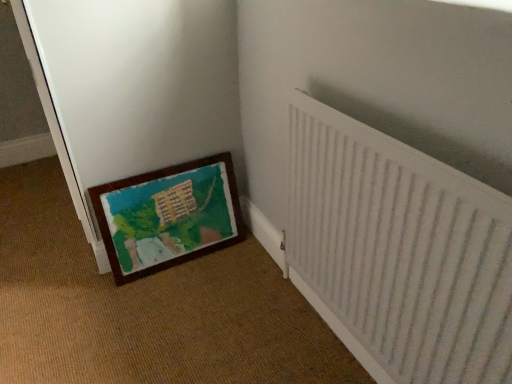
Question: Considering the relative sizes of wooden picture frame at lower left and wooden painted mat at lower left in the image provided, is wooden picture frame at lower left wider than wooden painted mat at lower left?

Choices:
 (A) no
 (B) yes

Answer: (A)

Question: Is wooden picture frame at lower left outside wooden painted mat at lower left?

Choices:
 (A) no
 (B) yes

Answer: (A)

Question: Considering the relative sizes of wooden picture frame at lower left and wooden painted mat at lower left in the image provided, is wooden picture frame at lower left thinner than wooden painted mat at lower left?

Choices:
 (A) no
 (B) yes

Answer: (B)

Question: Is the position of wooden picture frame at lower left more distant than that of wooden painted mat at lower left?

Choices:
 (A) no
 (B) yes

Answer: (B)

Question: Is wooden picture frame at lower left positioned with its back to wooden painted mat at lower left?

Choices:
 (A) no
 (B) yes

Answer: (B)

Question: Is wooden picture frame at lower left to the left of wooden painted mat at lower left from the viewer's perspective?

Choices:
 (A) yes
 (B) no

Answer: (B)

Question: Is wooden painted mat at lower left outside of white textured radiator at right?

Choices:
 (A) no
 (B) yes

Answer: (B)

Question: Is wooden painted mat at lower left behind white textured radiator at right?

Choices:
 (A) no
 (B) yes

Answer: (B)

Question: From the image's perspective, is wooden painted mat at lower left below white textured radiator at right?

Choices:
 (A) yes
 (B) no

Answer: (B)

Question: Does wooden painted mat at lower left have a larger size compared to white textured radiator at right?

Choices:
 (A) no
 (B) yes

Answer: (B)

Question: From a real-world perspective, is wooden painted mat at lower left physically above white textured radiator at right?

Choices:
 (A) no
 (B) yes

Answer: (B)

Question: From the image's perspective, is wooden painted mat at lower left located above white textured radiator at right?

Choices:
 (A) no
 (B) yes

Answer: (B)

Question: From the image's perspective, is wooden picture frame at lower left beneath white textured radiator at right?

Choices:
 (A) yes
 (B) no

Answer: (B)